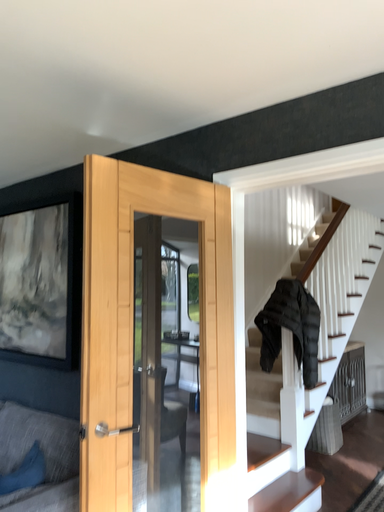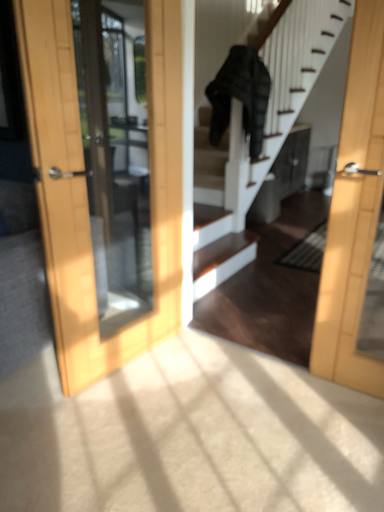
Question: Which way did the camera rotate in the video?

Choices:
 (A) rotated upward
 (B) rotated downward

Answer: (B)